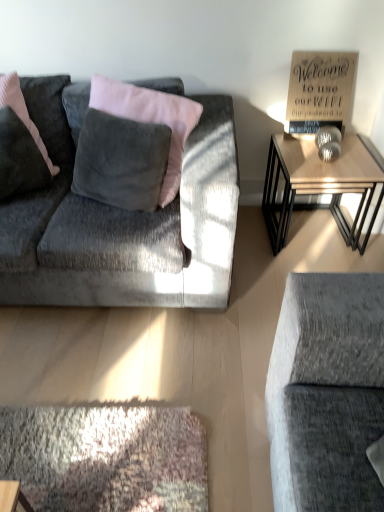
The width and height of the screenshot is (384, 512). In order to click on free space in front of velvet gray couch at left in this screenshot , I will do `click(120, 396)`.